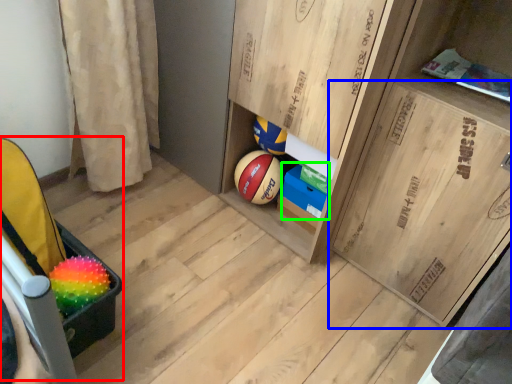
Question: Based on their relative distances, which object is farther from baby carriage (highlighted by a red box)? Choose from cabinetry (highlighted by a blue box) and cabinetry (highlighted by a green box).

Choices:
 (A) cabinetry
 (B) cabinetry

Answer: (A)